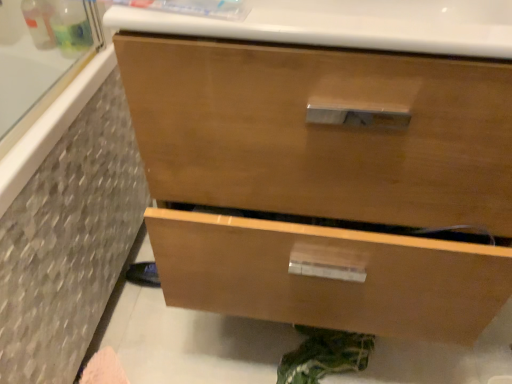
Question: Considering the relative positions of matte gray tile at left and glossy wood drawer at center in the image provided, is matte gray tile at left to the right of glossy wood drawer at center from the viewer's perspective?

Choices:
 (A) yes
 (B) no

Answer: (B)

Question: Does matte gray tile at left have a greater width compared to glossy wood drawer at center?

Choices:
 (A) no
 (B) yes

Answer: (B)

Question: Can you confirm if matte gray tile at left is taller than glossy wood drawer at center?

Choices:
 (A) no
 (B) yes

Answer: (A)

Question: From the image's perspective, is matte gray tile at left on top of glossy wood drawer at center?

Choices:
 (A) no
 (B) yes

Answer: (A)

Question: Considering the relative sizes of matte gray tile at left and glossy wood drawer at center in the image provided, is matte gray tile at left bigger than glossy wood drawer at center?

Choices:
 (A) no
 (B) yes

Answer: (A)

Question: Is there a large distance between matte gray tile at left and glossy wood drawer at center?

Choices:
 (A) yes
 (B) no

Answer: (B)

Question: Considering the relative sizes of glossy wood drawer at center and matte gray tile at left in the image provided, is glossy wood drawer at center smaller than matte gray tile at left?

Choices:
 (A) yes
 (B) no

Answer: (B)

Question: From a real-world perspective, is glossy wood drawer at center on top of matte gray tile at left?

Choices:
 (A) no
 (B) yes

Answer: (B)

Question: Is glossy wood drawer at center behind matte gray tile at left?

Choices:
 (A) no
 (B) yes

Answer: (A)

Question: Is glossy wood drawer at center oriented away from matte gray tile at left?

Choices:
 (A) yes
 (B) no

Answer: (B)

Question: Is matte gray tile at left located within glossy wood drawer at center?

Choices:
 (A) yes
 (B) no

Answer: (B)

Question: Is glossy wood drawer at center shorter than matte gray tile at left?

Choices:
 (A) no
 (B) yes

Answer: (A)

Question: In terms of height, does matte gray tile at left look taller or shorter compared to glossy wood drawer at center?

Choices:
 (A) short
 (B) tall

Answer: (A)